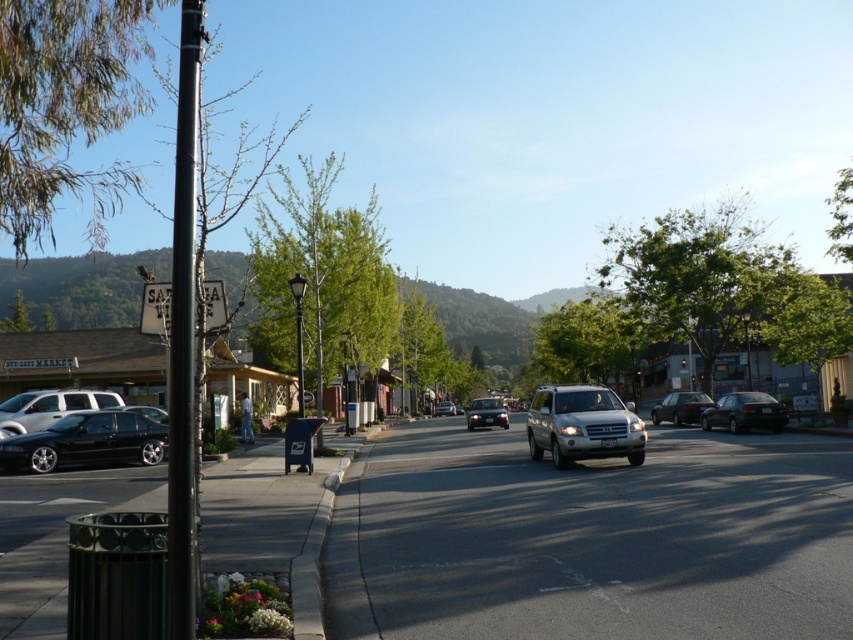
Is satin silver suv at center smaller than silver metallic suv at left?

No.

You are a GUI agent. You are given a task and a screenshot of the screen. Output one action in this format:
    pyautogui.click(x=<x>, y=<y>)
    Task: Click on the satin silver suv at center
    
    Given the screenshot: What is the action you would take?
    pyautogui.click(x=583, y=426)

Is satin silver suv at center to the left of matte silver sedan at center from the viewer's perspective?

Incorrect, satin silver suv at center is not on the left side of matte silver sedan at center.

Is point (624, 413) less distant than point (444, 404)?

Yes, it is in front of point (444, 404).

I want to click on satin silver suv at center, so click(583, 426).

You are a GUI agent. You are given a task and a screenshot of the screen. Output one action in this format:
    pyautogui.click(x=<x>, y=<y>)
    Task: Click on the satin silver suv at center
    The height and width of the screenshot is (640, 853).
    Given the screenshot: What is the action you would take?
    [583, 426]

Is silver metallic suv at left positioned behind shiny black sedan at center?

No, it is in front of shiny black sedan at center.

Which is above, silver metallic suv at left or shiny black sedan at center?

Positioned higher is silver metallic suv at left.

The width and height of the screenshot is (853, 640). Describe the element at coordinates (49, 406) in the screenshot. I see `silver metallic suv at left` at that location.

The image size is (853, 640). Identify the location of silver metallic suv at left. (49, 406).